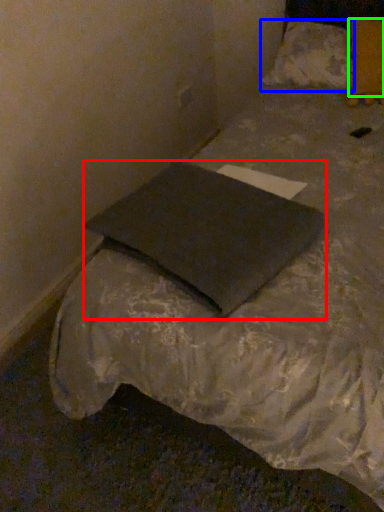
Question: Which is farther away from pillow (highlighted by a red box)? pillow (highlighted by a blue box) or pillow (highlighted by a green box)?

Choices:
 (A) pillow
 (B) pillow

Answer: (A)